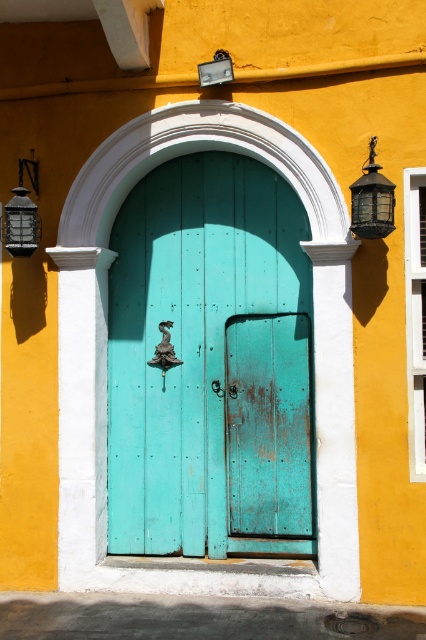
Is point (22, 179) positioned before point (221, 74)?

No, it is behind (221, 74).

Does matte black lantern at left have a lesser height compared to metallic glass at upper center?

No, matte black lantern at left is not shorter than metallic glass at upper center.

Which is in front, point (36, 248) or point (207, 68)?

Point (207, 68)

Image resolution: width=426 pixels, height=640 pixels. What are the coordinates of `matte black lantern at left` in the screenshot? It's located at (22, 216).

Is point (253, 416) closer to viewer compared to point (25, 166)?

No, it is not.

Measure the distance between point (192,428) and camera.

6.25 meters

At what (x,y) coordinates should I click in order to perform the action: click on teal wooden door at center. Please return your answer as a coordinate pair (x, y). The width and height of the screenshot is (426, 640). Looking at the image, I should click on (210, 364).

Between matte black lantern at upper right and metallic glass at upper center, which one has more height?

matte black lantern at upper right

Does matte black lantern at upper right have a greater height compared to metallic glass at upper center?

Indeed, matte black lantern at upper right has a greater height compared to metallic glass at upper center.

Is point (368, 234) closer to camera compared to point (215, 51)?

Yes, it is in front of point (215, 51).

Locate an element on the screen. The width and height of the screenshot is (426, 640). matte black lantern at upper right is located at coordinates (371, 200).